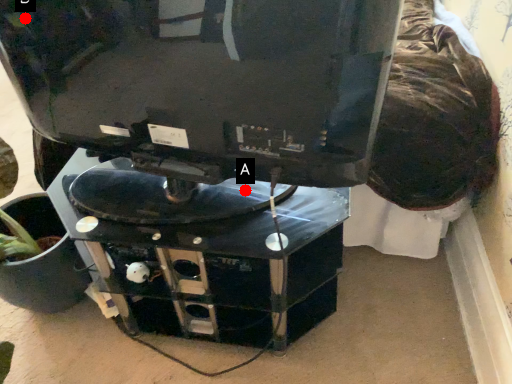
Question: Two points are circled on the image, labeled by A and B beside each circle. Which point appears closest to the camera in this image?

Choices:
 (A) A is closer
 (B) B is closer

Answer: (B)